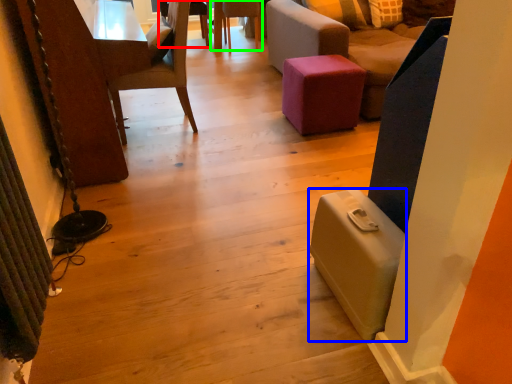
Question: Considering the real-world distances, which object is farthest from chair (highlighted by a red box)? luggage (highlighted by a blue box) or chair (highlighted by a green box)?

Choices:
 (A) luggage
 (B) chair

Answer: (A)